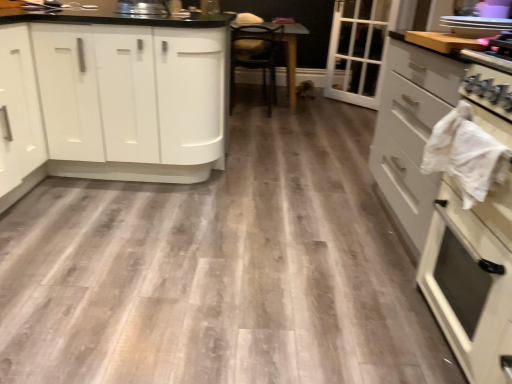
Question: Is white glass door at upper right completely or partially inside wooden table at center?

Choices:
 (A) no
 (B) yes

Answer: (A)

Question: Considering the relative positions of wooden table at center and white glass door at upper right in the image provided, is wooden table at center to the right of white glass door at upper right from the viewer's perspective?

Choices:
 (A) no
 (B) yes

Answer: (A)

Question: From the image's perspective, is wooden table at center beneath white glass door at upper right?

Choices:
 (A) no
 (B) yes

Answer: (B)

Question: Is wooden table at center far away from white glass door at upper right?

Choices:
 (A) no
 (B) yes

Answer: (A)

Question: Considering the relative sizes of wooden table at center and white glass door at upper right in the image provided, is wooden table at center shorter than white glass door at upper right?

Choices:
 (A) yes
 (B) no

Answer: (A)

Question: Is white glossy cabinets at left, the first cabinetry from the back, taller or shorter than white glass door at upper right?

Choices:
 (A) tall
 (B) short

Answer: (B)

Question: Based on their positions, is white glossy cabinets at left, which is the second cabinetry in front-to-back order, located to the left or right of white glass door at upper right?

Choices:
 (A) right
 (B) left

Answer: (B)

Question: Is point click(202, 152) closer or farther from the camera than point click(335, 92)?

Choices:
 (A) closer
 (B) farther

Answer: (A)

Question: In terms of width, does white glossy cabinets at left, the 1th cabinetry positioned from the left, look wider or thinner when compared to white glass door at upper right?

Choices:
 (A) thin
 (B) wide

Answer: (B)

Question: Do you think white glossy plates at upper right is within white glossy oven at right, which is counted as the second cabinetry, starting from the top, or outside of it?

Choices:
 (A) inside
 (B) outside

Answer: (B)

Question: Visually, is white glossy plates at upper right positioned to the left or to the right of white glossy oven at right, the 1th cabinetry when ordered from right to left?

Choices:
 (A) left
 (B) right

Answer: (B)

Question: In the image, is white glossy plates at upper right positioned in front of or behind white glossy oven at right, placed as the 1th cabinetry when sorted from front to back?

Choices:
 (A) front
 (B) behind

Answer: (B)

Question: From a real-world perspective, relative to white glossy oven at right, acting as the 2th cabinetry starting from the left, is white glossy plates at upper right vertically above or below?

Choices:
 (A) below
 (B) above

Answer: (B)

Question: Considering the positions of point (26, 158) and point (291, 48), is point (26, 158) closer or farther from the camera than point (291, 48)?

Choices:
 (A) closer
 (B) farther

Answer: (A)

Question: Looking at their shapes, would you say white glossy cabinets at left, which is the second cabinetry in front-to-back order, is wider or thinner than wooden table at center?

Choices:
 (A) thin
 (B) wide

Answer: (B)